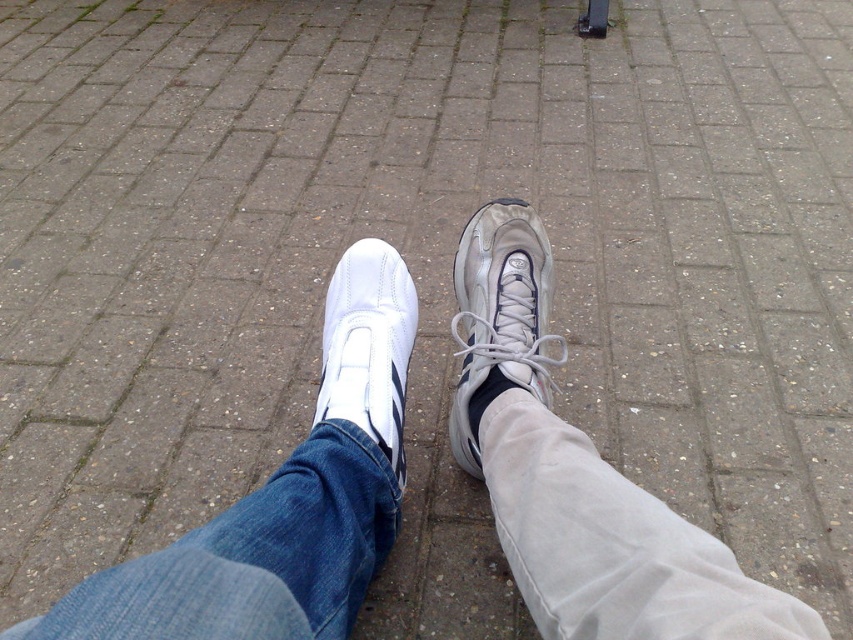
Describe the element at coordinates (498, 316) in the screenshot. I see `satin silver sneaker at center` at that location.

Is point (498, 230) in front of point (467, 416)?

No, (498, 230) is further to viewer.

Locate an element on the screen. The image size is (853, 640). satin silver sneaker at center is located at coordinates (498, 316).

Who is lower down, white leather shoe at left or suede-like gray ankle at center?

suede-like gray ankle at center is lower down.

From the picture: Is white leather shoe at left thinner than suede-like gray ankle at center?

No.

Between point (318, 406) and point (490, 372), which one is positioned behind?

Positioned behind is point (318, 406).

Identify the location of white leather shoe at left. (368, 346).

From the picture: Is satin silver sneaker at center further to camera compared to white leather shoe at left?

Yes, it is behind white leather shoe at left.

Is point (549, 257) farther from camera compared to point (370, 314)?

Yes.

Which is in front, point (511, 365) or point (352, 289)?

Positioned in front is point (511, 365).

Locate an element on the screen. Image resolution: width=853 pixels, height=640 pixels. satin silver sneaker at center is located at coordinates (498, 316).